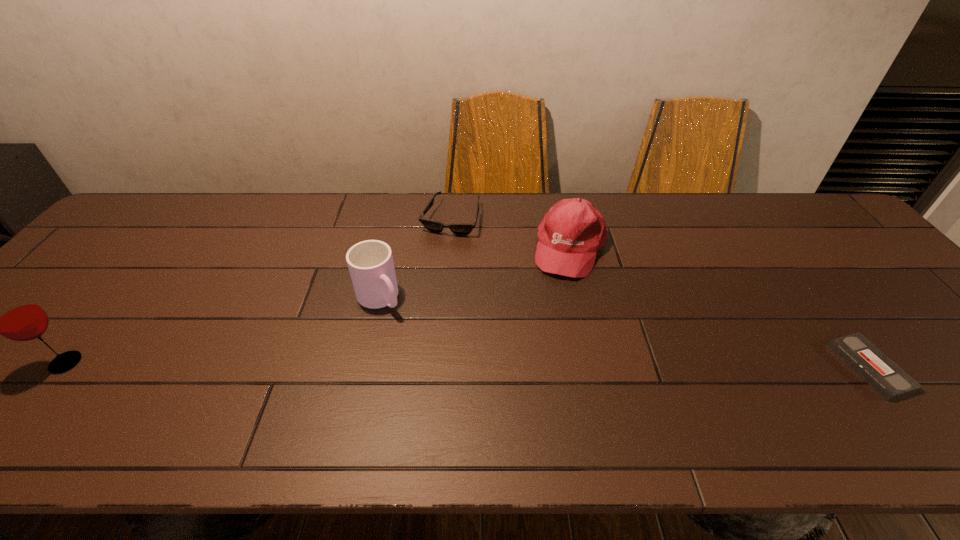
You are a GUI agent. You are given a task and a screenshot of the screen. Output one action in this format:
    pyautogui.click(x=<x>, y=<y>)
    Task: Click on the free space at the far right corner of the desktop
    The height and width of the screenshot is (540, 960).
    Given the screenshot: What is the action you would take?
    pyautogui.click(x=793, y=232)

Find the location of a particular element. The width and height of the screenshot is (960, 540). vacant space that is in between the fourth object from left to right and the shortest object is located at coordinates (720, 307).

Image resolution: width=960 pixels, height=540 pixels. In order to click on vacant region between the leftmost object and the baseball cap in this screenshot , I will do `click(318, 305)`.

The height and width of the screenshot is (540, 960). I want to click on empty space that is in between the second object from left to right and the fourth object from left to right, so click(x=474, y=273).

Where is `free spot between the second object from right to left and the glass`? The width and height of the screenshot is (960, 540). free spot between the second object from right to left and the glass is located at coordinates (318, 305).

Where is `vacant space in between the glass and the sunglasses`? The image size is (960, 540). vacant space in between the glass and the sunglasses is located at coordinates (258, 291).

Find the location of a particular element. This screenshot has height=540, width=960. vacant space that is in between the baseball cap and the rightmost object is located at coordinates (720, 307).

Where is `empty location between the tallest object and the rightmost object`? This screenshot has width=960, height=540. empty location between the tallest object and the rightmost object is located at coordinates 468,365.

The height and width of the screenshot is (540, 960). What are the coordinates of `empty space that is in between the tallest object and the fourth object from right to left` in the screenshot? It's located at coord(223,330).

At what (x,y) coordinates should I click in order to perform the action: click on unoccupied area between the videotape and the glass. Please return your answer as a coordinate pair (x, y). This screenshot has height=540, width=960. Looking at the image, I should click on (468, 365).